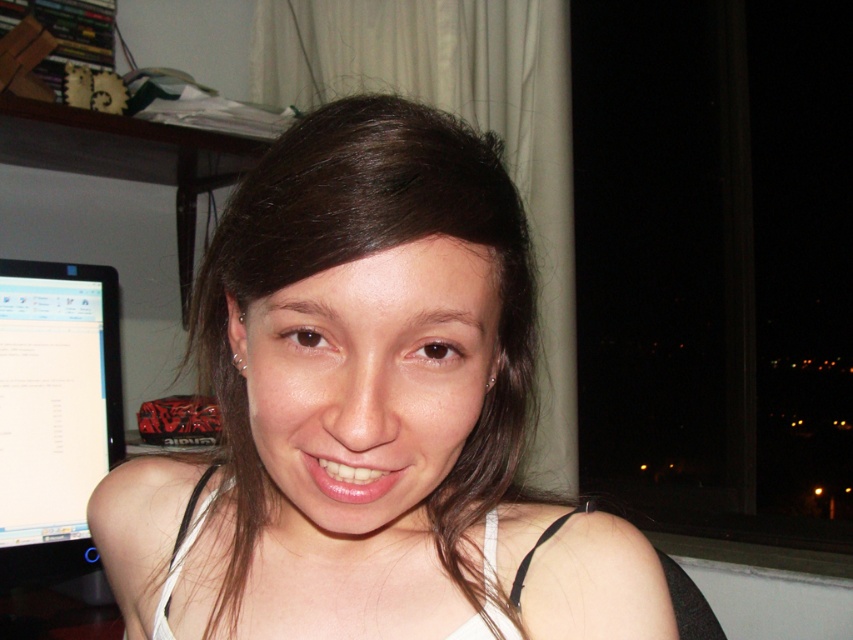
From the picture: You are standing in the room shown in the image and want to move from the point at coordinates point (248, 320) to the point at coordinates point (74, 353). Which direction should you move in to get closer to your destination?

You should move downward because point (248, 320) is closer to the viewer than point (74, 353), so moving downward would take you towards the destination.

You are a photographer trying to capture a portrait of the person in the image. The smooth skin face at center and the black glossy monitor at left are both in the frame. Which object is wider?

The smooth skin face at center is wider than the black glossy monitor at left according to the description.